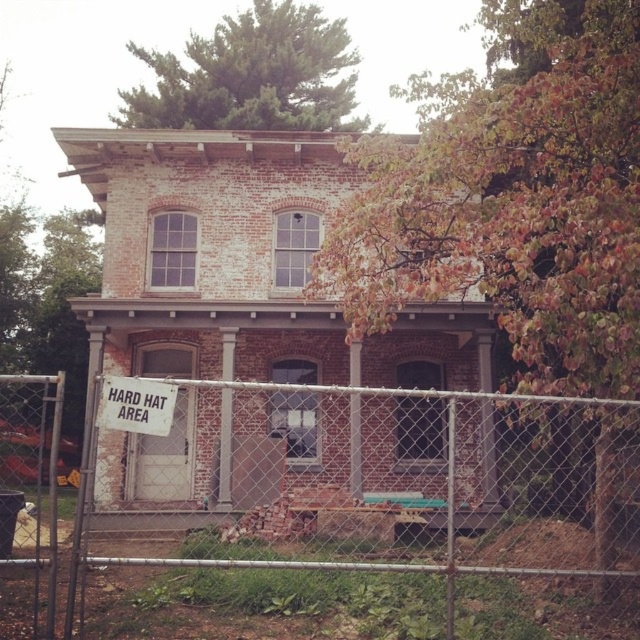
Is white chain-link fence at center further to camera compared to white paper sign at lower left?

That is False.

Who is higher up, white chain-link fence at center or white paper sign at lower left?

Positioned higher is white paper sign at lower left.

This screenshot has height=640, width=640. Describe the element at coordinates (332, 512) in the screenshot. I see `white chain-link fence at center` at that location.

Locate an element on the screen. The height and width of the screenshot is (640, 640). white chain-link fence at center is located at coordinates (332, 512).